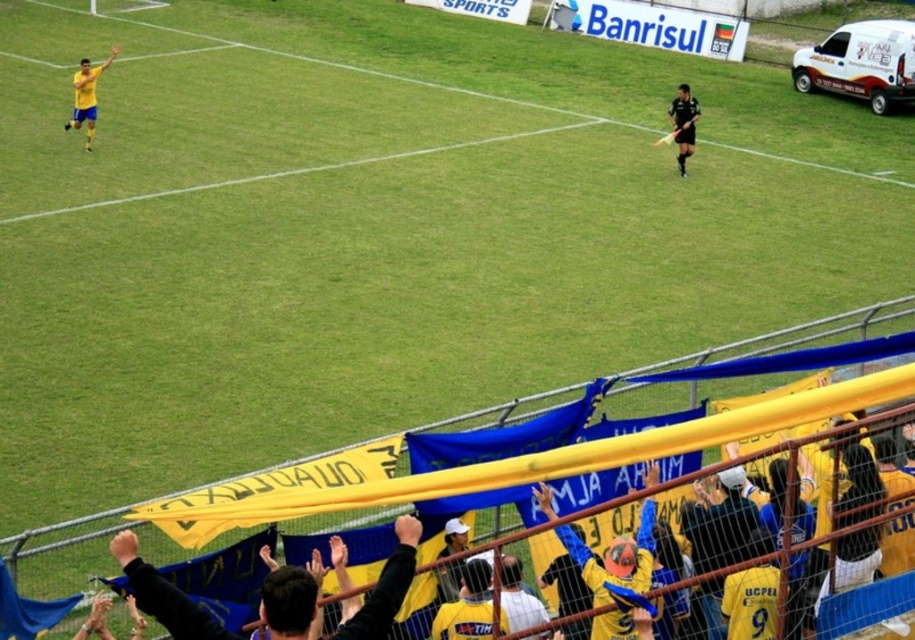
Question: Can you confirm if matte yellow shorts at left is thinner than black matte uniform at center?

Choices:
 (A) no
 (B) yes

Answer: (A)

Question: Which point is farther to the camera?

Choices:
 (A) (679, 161)
 (B) (92, 92)

Answer: (B)

Question: Is matte yellow shorts at left to the right of black matte uniform at center from the viewer's perspective?

Choices:
 (A) no
 (B) yes

Answer: (A)

Question: Is matte yellow shorts at left bigger than black matte uniform at center?

Choices:
 (A) yes
 (B) no

Answer: (B)